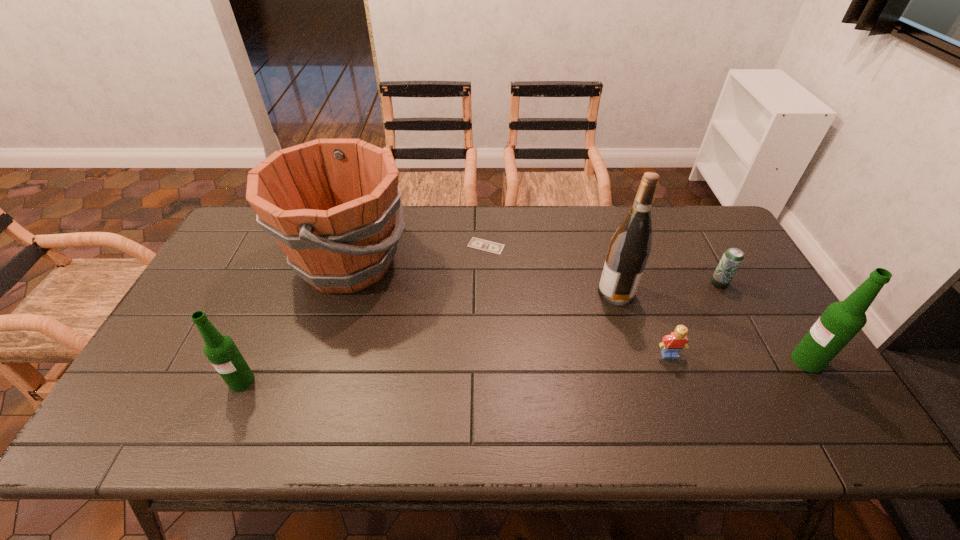
Locate an element on the screen. The height and width of the screenshot is (540, 960). vacant space in between the third object from left to right and the tallest object is located at coordinates (551, 269).

Identify the location of free space that is in between the third object from right to left and the taller beer bottle. (738, 357).

This screenshot has height=540, width=960. I want to click on vacant space in between the money and the wine bottle, so pyautogui.click(x=551, y=269).

The height and width of the screenshot is (540, 960). Identify the location of free space between the rightmost object and the tallest object. (711, 326).

What are the coordinates of `free space between the money and the beer can` in the screenshot? It's located at (603, 265).

Locate an element on the screen. This screenshot has width=960, height=540. free point between the beer can and the third object from right to left is located at coordinates (694, 319).

Identify the location of vacant area between the Lego and the right beer bottle. (738, 357).

At what (x,y) coordinates should I click in order to perform the action: click on free space between the fourth object from left to right and the fourth tallest object. Please return your answer as a coordinate pair (x, y). This screenshot has height=540, width=960. Looking at the image, I should click on (429, 337).

The width and height of the screenshot is (960, 540). Find the location of `empty location between the shortest object and the fourth tallest object`. empty location between the shortest object and the fourth tallest object is located at coordinates (364, 314).

Identify the location of the fourth closest object to the wine bottle. (841, 321).